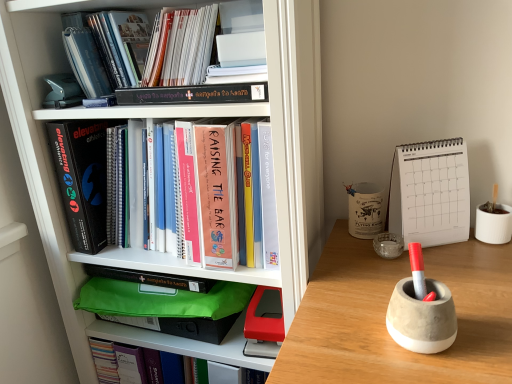
Question: Considering the positions of point (157, 41) and point (394, 253), is point (157, 41) closer or farther from the camera than point (394, 253)?

Choices:
 (A) closer
 (B) farther

Answer: (A)

Question: In terms of size, does matte paper folder at upper center, arranged as the 4th book when ordered from the bottom, appear bigger or smaller than clear glass ashtray at center-right, the second stationery when ordered from back to front?

Choices:
 (A) big
 (B) small

Answer: (A)

Question: Estimate the real-world distances between objects in this image. Which object is closer to the green matte folder at center, which ranks as the fourth book in top-to-bottom order?

Choices:
 (A) white paper calendar at upper right, which is the 1th paperback book in right-to-left order
 (B) white matte bookcase at left
 (C) clear glass ashtray at center-right, which is the 2th stationery in top-to-bottom order
 (D) matte paper folder at upper center, placed as the first book when sorted from top to bottom
 (E) black matte book at left, the second paperback book positioned from the right

Answer: (B)

Question: Which is farther from the white ceramic mug at right, which is counted as the 3th stationery, starting from the front?

Choices:
 (A) clear glass ashtray at center-right, which is the 2th stationery from front to back
 (B) concrete pen holder at right, the third stationery positioned from the back
 (C) white paper calendar at upper right, which is the 1th paperback book in right-to-left order
 (D) black matte book at left, which ranks as the first paperback book in left-to-right order
 (E) white matte bookcase at left

Answer: (D)